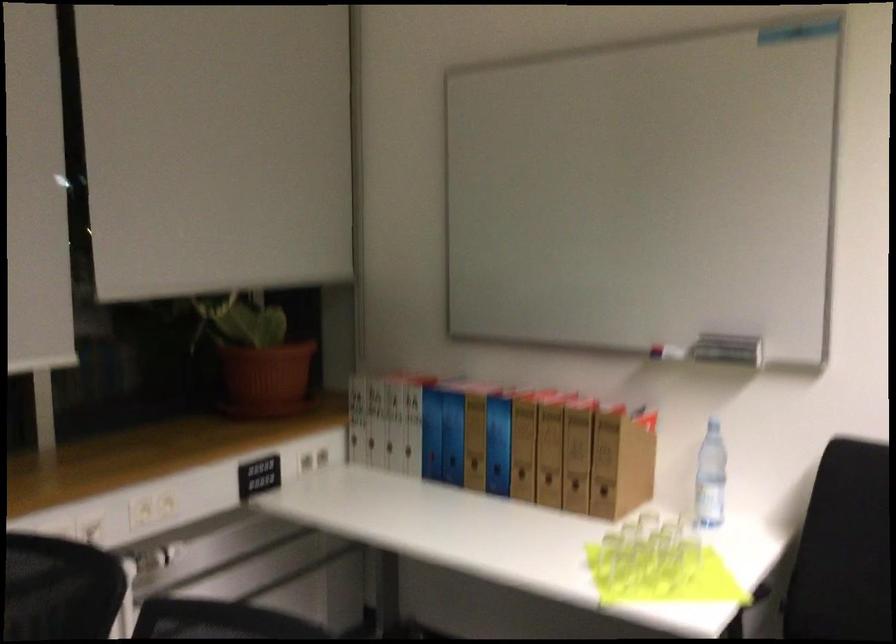
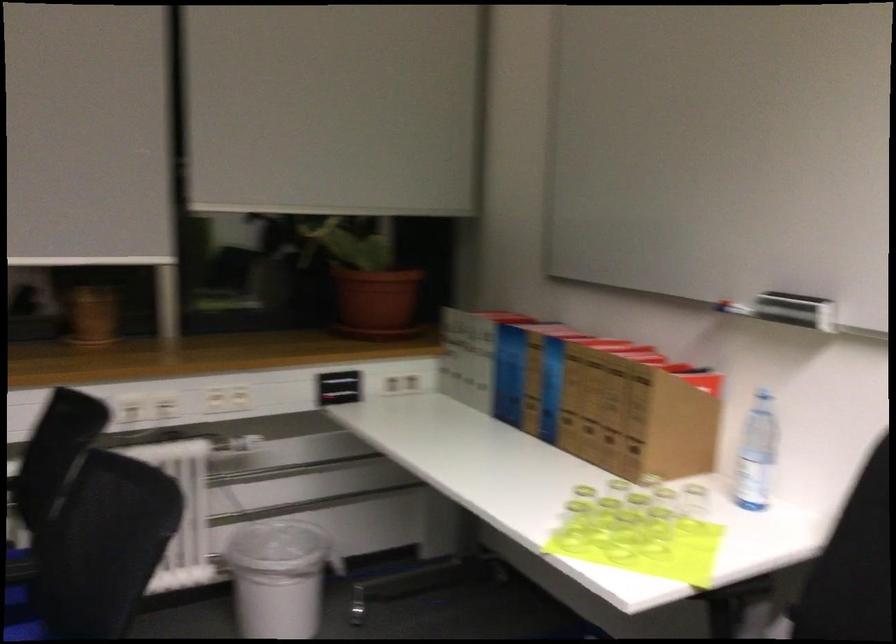
Where in the second image is the point corresponding to (653,573) from the first image?

(623, 536)